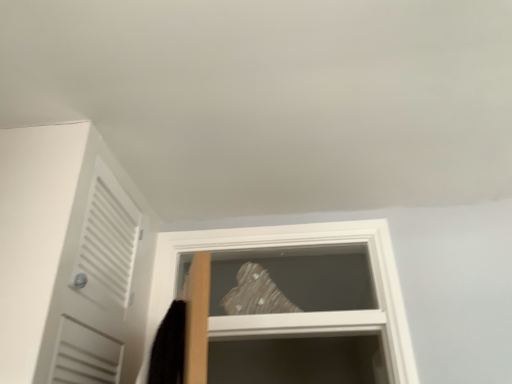
This screenshot has height=384, width=512. Describe the element at coordinates (295, 313) in the screenshot. I see `wooden textured door at center` at that location.

Find the location of `wooden textured door at center`. wooden textured door at center is located at coordinates (295, 313).

Locate an element on the screen. This screenshot has width=512, height=384. wooden textured door at center is located at coordinates (295, 313).